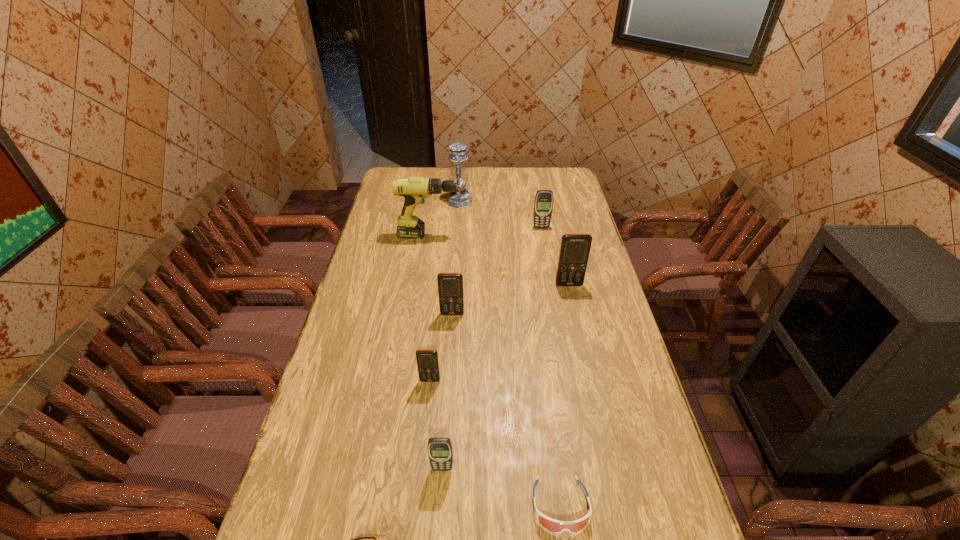
Find the location of a particular element. The image size is (960, 540). the left gray cellular telephone is located at coordinates (440, 452).

Identify the location of the smaller gray cellular telephone. The height and width of the screenshot is (540, 960). (440, 452).

Where is `red goggles`? red goggles is located at coordinates (556, 526).

Identify the location of the right goggles. (556, 526).

Image resolution: width=960 pixels, height=540 pixels. What are the coordinates of `free space located 0.100m on the front-facing side of the lantern` in the screenshot? It's located at (493, 200).

The height and width of the screenshot is (540, 960). I want to click on free spot located 0.260m on the handle side of the drill, so click(x=524, y=235).

Where is `vacant space located on the screen of the farthest orange cellular telephone`? The image size is (960, 540). vacant space located on the screen of the farthest orange cellular telephone is located at coordinates [590, 379].

Identify the location of vacant position located 0.340m on the screen of the farther gray cellular telephone. (551, 282).

I want to click on free space located on the screen of the fifth nearest object, so click(448, 374).

Find the location of a particular element. The width and height of the screenshot is (960, 540). free space located on the screen of the fourth farthest cellular telephone is located at coordinates (419, 491).